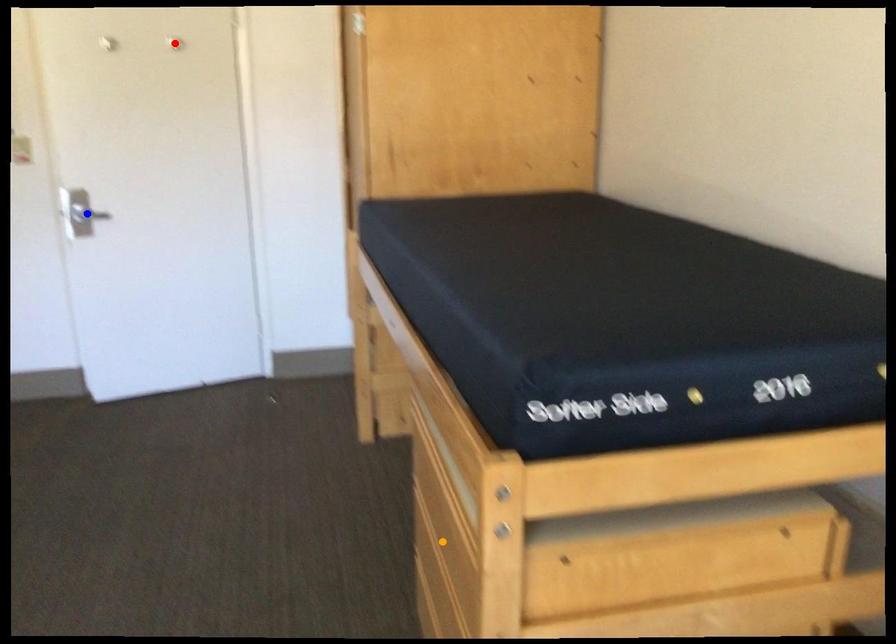
Order these from nearest to farthest:
red point
orange point
blue point

orange point → blue point → red point